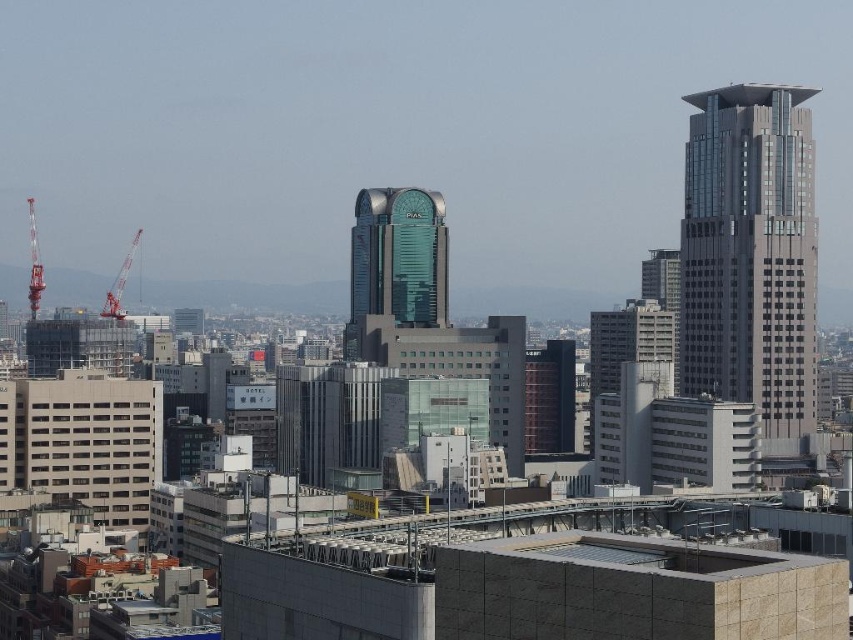
What do you see at coordinates (399, 256) in the screenshot?
I see `green glass tower at center` at bounding box center [399, 256].

Between green glass tower at center and orange metallic crane at left, which one is positioned higher?

green glass tower at center is above.

Measure the distance between point (361, 188) and camera.

2144.00 feet

Identify the location of green glass tower at center. (399, 256).

Between glassy gray skyscraper at right and orange metallic crane at left, which one is positioned higher?

Positioned higher is glassy gray skyscraper at right.

Who is shorter, glassy gray skyscraper at right or orange metallic crane at left?

Standing shorter between the two is orange metallic crane at left.

Does point (685, 161) lie behind point (115, 307)?

Yes, it is behind point (115, 307).

I want to click on glassy gray skyscraper at right, so point(750,253).

Between green glass tower at center and metallic red crane at left, which one appears on the right side from the viewer's perspective?

From the viewer's perspective, green glass tower at center appears more on the right side.

Does green glass tower at center appear over metallic red crane at left?

Incorrect, green glass tower at center is not positioned above metallic red crane at left.

Identify the location of green glass tower at center. (399, 256).

Where is `green glass tower at center`? This screenshot has width=853, height=640. green glass tower at center is located at coordinates (399, 256).